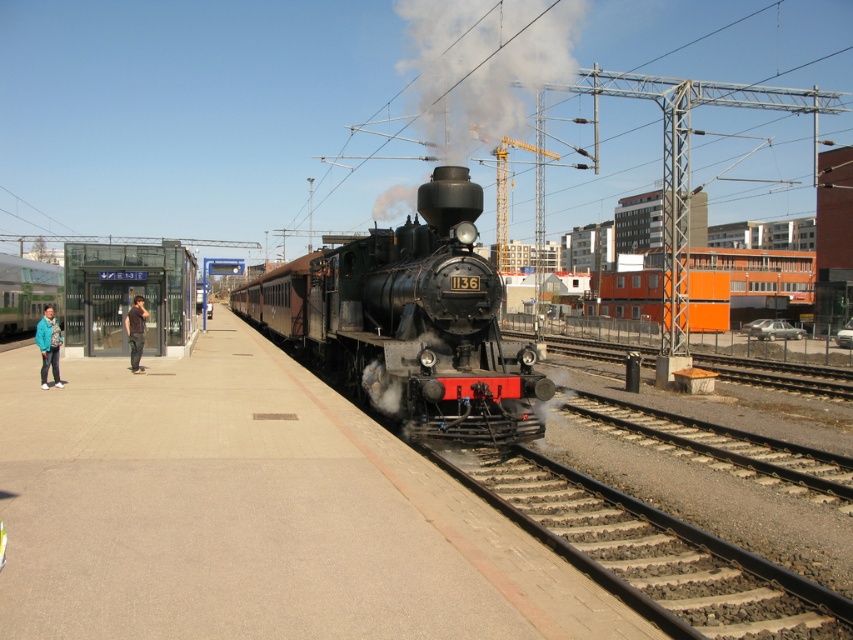
What do you see at coordinates (48, 346) in the screenshot?
I see `jeans at left` at bounding box center [48, 346].

Is jeans at left in front of dark gray pants at left?

Yes, it is.

Is point (50, 317) closer to camera compared to point (126, 321)?

That is True.

Where is `jeans at left`? The image size is (853, 640). jeans at left is located at coordinates (48, 346).

Is white smoke at center below dark gray pants at left?

Actually, white smoke at center is above dark gray pants at left.

Can you confirm if white smoke at center is bigger than dark gray pants at left?

Yes.

What do you see at coordinates (485, 64) in the screenshot?
I see `white smoke at center` at bounding box center [485, 64].

You are a GUI agent. You are given a task and a screenshot of the screen. Output one action in this format:
    pyautogui.click(x=<x>, y=<y>)
    Task: Click on the white smoke at center
    This screenshot has height=640, width=853.
    Given the screenshot: What is the action you would take?
    pyautogui.click(x=485, y=64)

Does point (393, 348) lie behind point (16, 300)?

No, it is in front of (16, 300).

Who is taller, polished black steam locomotive at center or matte green train at left?

With more height is matte green train at left.

Between point (345, 317) and point (13, 320), which one is positioned in front?

Point (345, 317)

The height and width of the screenshot is (640, 853). Find the location of `polished black steam locomotive at center`. polished black steam locomotive at center is located at coordinates (427, 323).